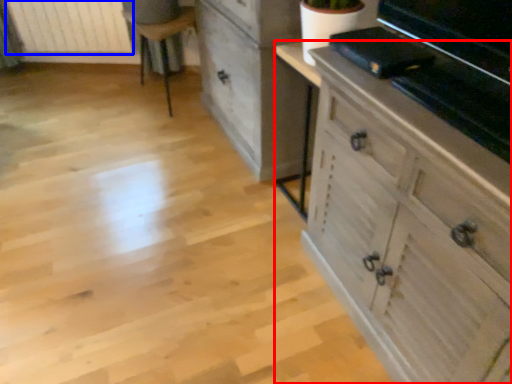
Question: Which object appears closest to the camera in this image, chest of drawers (highlighted by a red box) or radiator (highlighted by a blue box)?

Choices:
 (A) chest of drawers
 (B) radiator

Answer: (A)